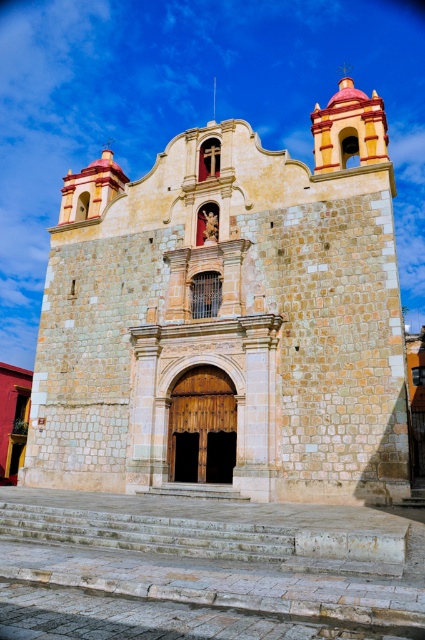
Is stone steps at center above white stone stairs at center?

Correct, stone steps at center is located above white stone stairs at center.

Does stone steps at center come in front of white stone stairs at center?

Yes, stone steps at center is in front of white stone stairs at center.

The height and width of the screenshot is (640, 425). What are the coordinates of `stone steps at center` in the screenshot? It's located at (207, 538).

Does beige stone church at center have a lesser width compared to stone steps at center?

No, beige stone church at center is not thinner than stone steps at center.

Is beige stone church at center below stone steps at center?

No.

The image size is (425, 640). I want to click on beige stone church at center, so click(x=227, y=320).

You are a GUI agent. You are given a task and a screenshot of the screen. Output one action in this format:
    pyautogui.click(x=<x>, y=<y>)
    Task: Click on the beige stone church at center
    
    Given the screenshot: What is the action you would take?
    pyautogui.click(x=227, y=320)

Can you confirm if beige stone church at center is smaller than white stone stairs at center?

No.

Which is in front, point (271, 244) or point (240, 499)?

Positioned in front is point (240, 499).

Locate an element on the screen. beige stone church at center is located at coordinates (227, 320).